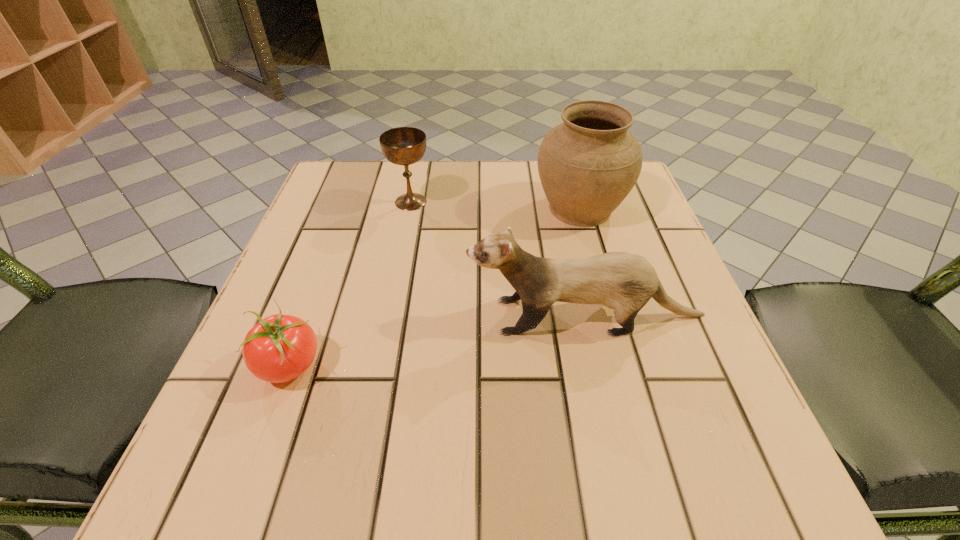
The image size is (960, 540). Identify the location of object that stands as the third closest to the ferret. (404, 146).

This screenshot has height=540, width=960. I want to click on object that is the closest to the tallest object, so click(x=625, y=282).